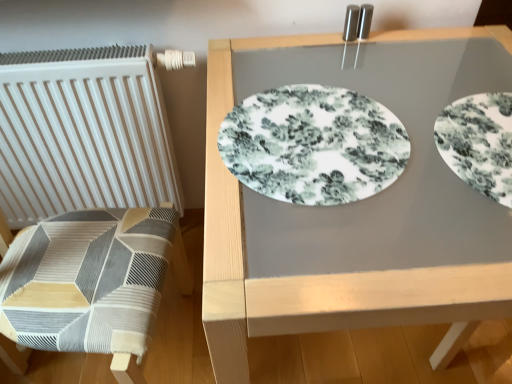
Identify the location of free point in front of white floral plate at center, the 2th plate in the right-to-left sequence. (343, 252).